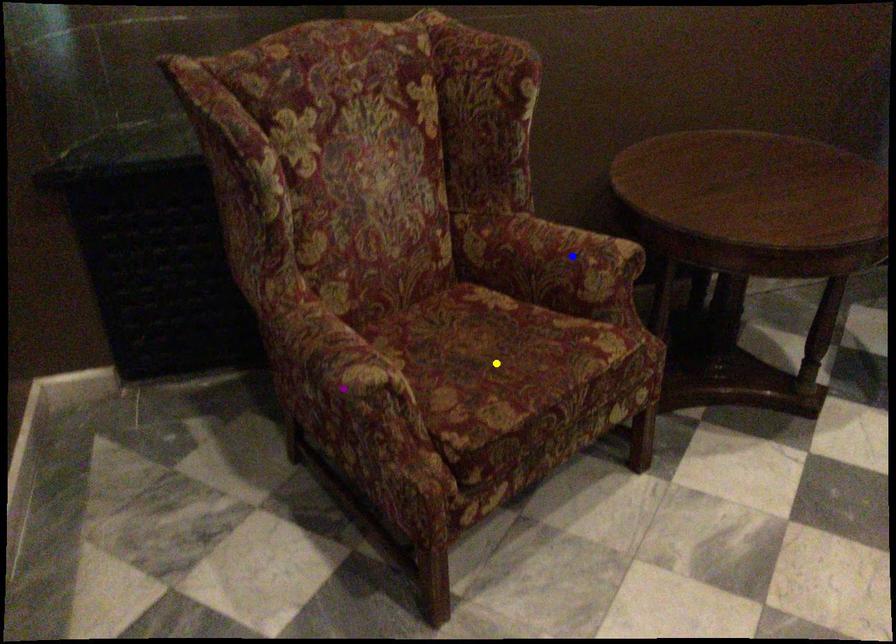
Order these from nearest to farthest:
- yellow point
- blue point
- purple point

purple point
yellow point
blue point